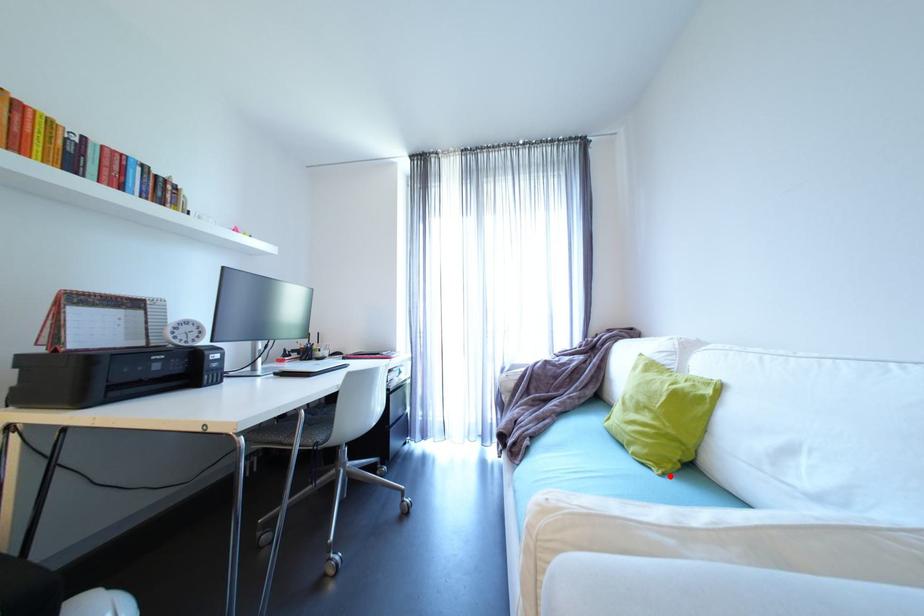
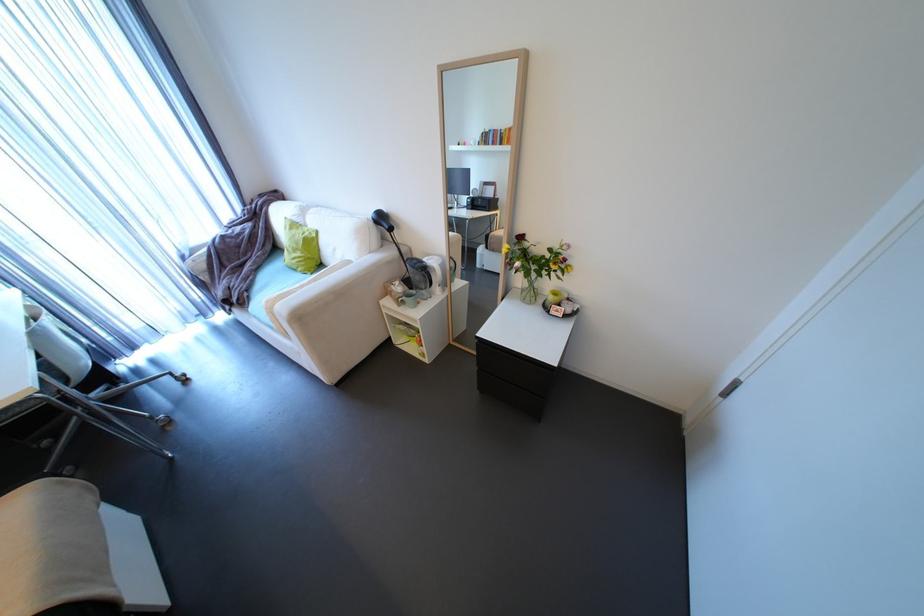
Locate, in the second image, the point that corresponds to the highlighted location in the first image.

(319, 274)